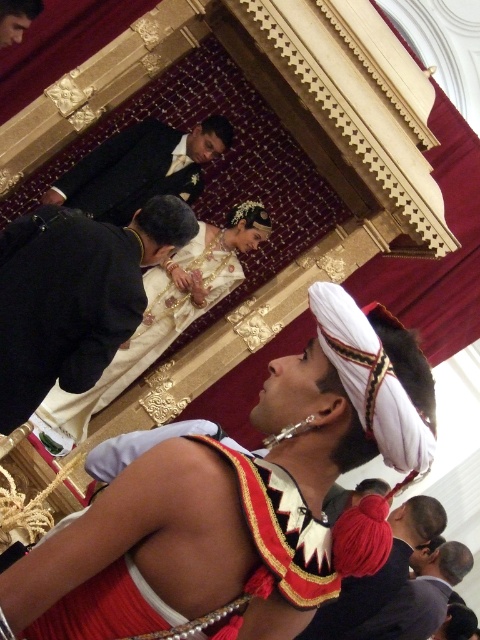
From the picture: Is white satin dress at center shorter than black velvet suit at upper left?

No.

Can you confirm if white satin dress at center is bigger than black velvet suit at upper left?

Correct, white satin dress at center is larger in size than black velvet suit at upper left.

Which is in front, point (175, 602) or point (105, 339)?

Point (175, 602) is in front.

Image resolution: width=480 pixels, height=640 pixels. What are the coordinates of `white satin dress at center` in the screenshot? It's located at (239, 502).

Can you confirm if black velvet suit at upper left is bigger than dark gray suit at lower right?

Indeed, black velvet suit at upper left has a larger size compared to dark gray suit at lower right.

Does black velvet suit at upper left appear over dark gray suit at lower right?

Correct, black velvet suit at upper left is located above dark gray suit at lower right.

You are a GUI agent. You are given a task and a screenshot of the screen. Output one action in this format:
    pyautogui.click(x=<x>, y=<y>)
    Task: Click on the black velvet suit at upper left
    This screenshot has width=480, height=640.
    Given the screenshot: What is the action you would take?
    pyautogui.click(x=74, y=298)

This screenshot has height=640, width=480. Find the location of `black velvet suit at upper left`. black velvet suit at upper left is located at coordinates (74, 298).

In the scene shown: Who is more forward, (268, 468) or (120, 216)?

Point (268, 468) is more forward.

Is point (287, 570) positioned behind point (205, 140)?

No, it is not.

Where is `red velvet robe at lower center`? The height and width of the screenshot is (640, 480). red velvet robe at lower center is located at coordinates (248, 508).

The image size is (480, 640). What are the coordinates of `red velvet robe at lower center` in the screenshot? It's located at (248, 508).